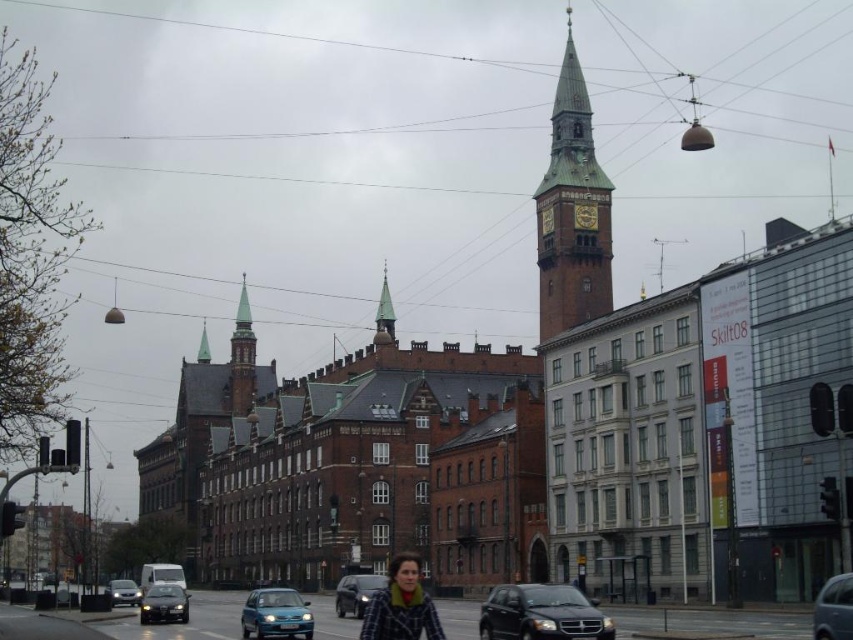
Does point (386, 588) lie behind point (573, 212)?

No, it is not.

Is plaid wool coat at center smaller than goldmetallicclock at center?

No, plaid wool coat at center is not smaller than goldmetallicclock at center.

Is point (408, 573) more distant than point (573, 224)?

No, (408, 573) is in front of (573, 224).

Image resolution: width=853 pixels, height=640 pixels. I want to click on plaid wool coat at center, so click(401, 605).

Does point (117, 604) come in front of point (589, 209)?

Yes, it is.

Between point (117, 592) and point (596, 227), which one is positioned in front?

Positioned in front is point (117, 592).

Does point (137, 600) come behind point (587, 224)?

That is False.

Identify the location of matte black sedan at lower left. The image size is (853, 640). (125, 593).

Does point (837, 628) lie behind point (575, 204)?

That is False.

Measure the distance between metallic silver car at lower right and camera.

152.32 feet

Identify the location of metallic silver car at lower right. Image resolution: width=853 pixels, height=640 pixels. (833, 609).